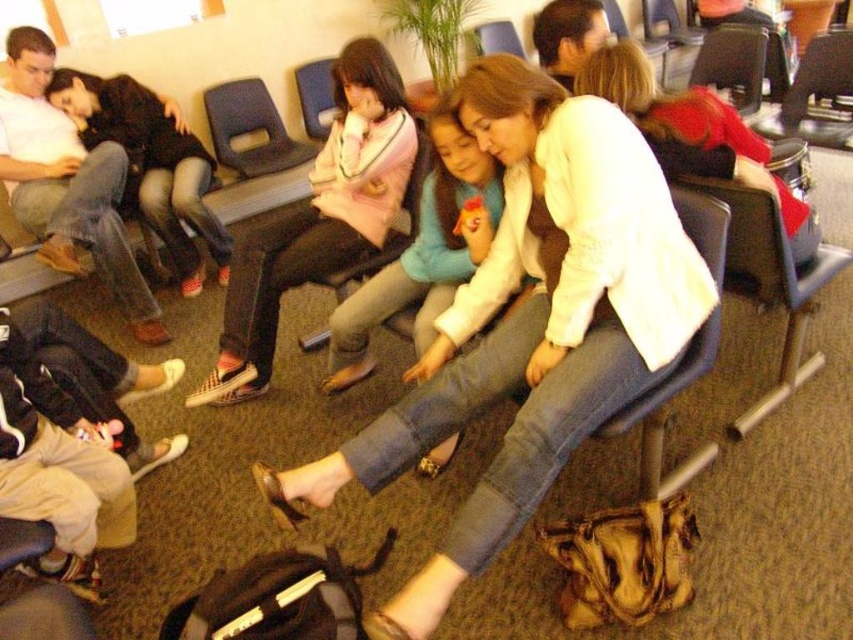
You are a photographer trying to capture a closeup of the white cotton shirt at center and the matte pink fabric at center. Since you want to focus on both items equally, which one should you zoom in on more to ensure they appear the same size in the photo?

The white cotton shirt at center is larger in size than the matte pink fabric at center. To make them appear the same size in the photo, you should zoom in more on the matte pink fabric at center so that its image becomes larger, balancing it with the white cotton shirt at center.

You are a person carrying a large suitcase that is 2 meters long. You are standing between the blue plastic chair at upper center and the matte black chair at center. Can you fit the suitcase horizontally between them without tilting it?

The blue plastic chair at upper center and matte black chair at center are 2.14 meters apart from each other. Since the suitcase is 2 meters long, it can fit horizontally between them as the distance is sufficient.

Based on the scene description, where is the blue plastic chair at upper center located in terms of its 2D coordinates?

The blue plastic chair at upper center is located at the 2D coordinates of point (250, 129).